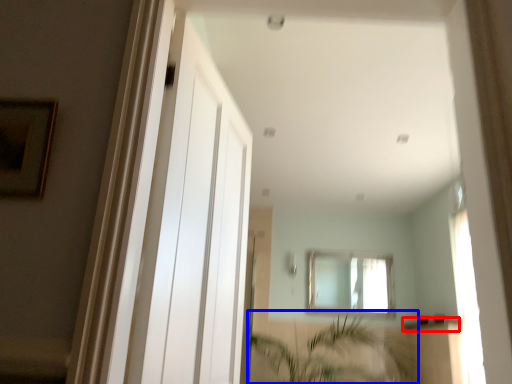
Question: Among these objects, which one is farthest to the camera, window sill (highlighted by a red box) or vegetation (highlighted by a blue box)?

Choices:
 (A) window sill
 (B) vegetation

Answer: (A)